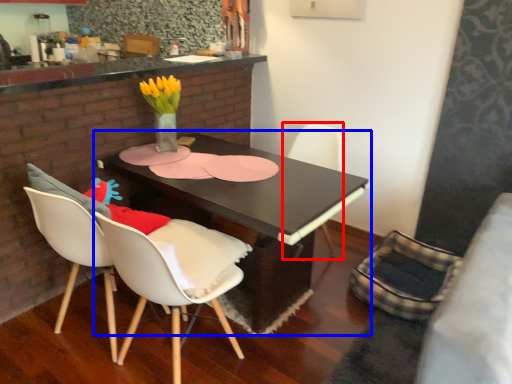
Question: Which object is further to the camera taking this photo, chair (highlighted by a red box) or table (highlighted by a blue box)?

Choices:
 (A) chair
 (B) table

Answer: (A)